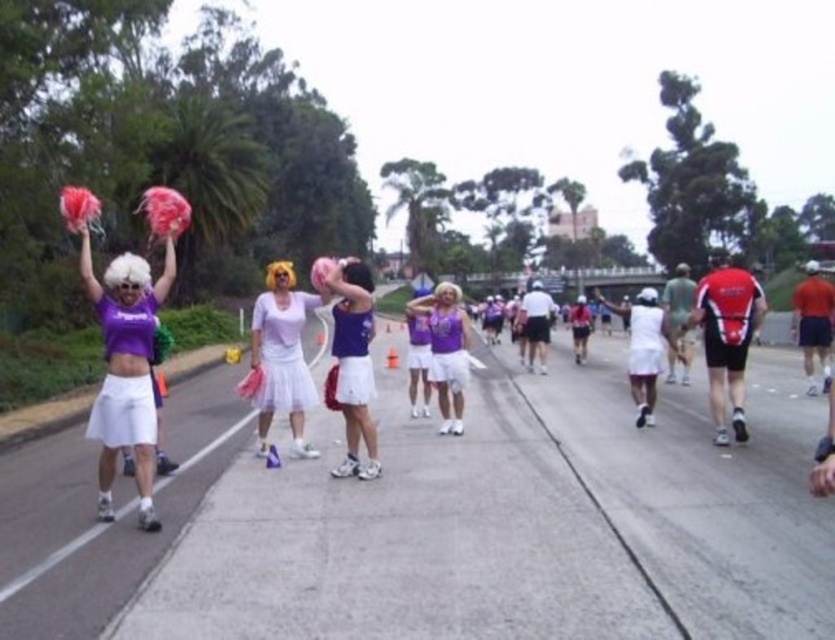
Can you confirm if white asphalt road at center is smaller than purple matte tank top at center?

No.

Does white asphalt road at center have a greater height compared to purple matte tank top at center?

No.

You are a GUI agent. You are given a task and a screenshot of the screen. Output one action in this format:
    pyautogui.click(x=<x>, y=<y>)
    Task: Click on the white asphalt road at center
    The image size is (835, 640).
    Given the screenshot: What is the action you would take?
    pyautogui.click(x=522, y=522)

Is point (347, 428) closer to camera compared to point (438, 317)?

Yes, point (347, 428) is in front of point (438, 317).

Identify the location of purple matte tank top at center. The height and width of the screenshot is (640, 835). (353, 364).

The width and height of the screenshot is (835, 640). What do you see at coordinates (282, 355) in the screenshot?
I see `white tulle skirt at center` at bounding box center [282, 355].

Image resolution: width=835 pixels, height=640 pixels. In order to click on white tulle skirt at center in this screenshot , I will do `click(282, 355)`.